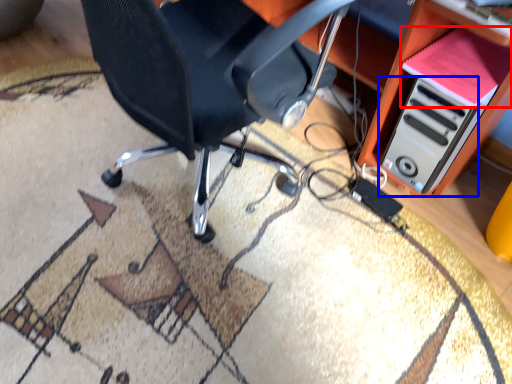
Question: Which object appears farthest to the camera in this image, book (highlighted by a red box) or computer tower (highlighted by a blue box)?

Choices:
 (A) book
 (B) computer tower

Answer: (B)